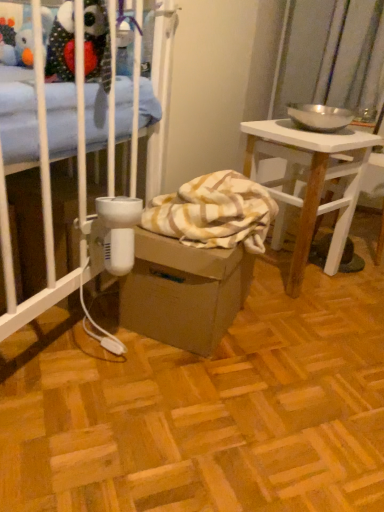
Question: Considering the relative positions of brown cardboard box at center and white wood desk at right in the image provided, is brown cardboard box at center to the left or to the right of white wood desk at right?

Choices:
 (A) right
 (B) left

Answer: (B)

Question: From a real-world perspective, relative to white wood desk at right, is brown cardboard box at center vertically above or below?

Choices:
 (A) above
 (B) below

Answer: (B)

Question: Is brown cardboard box at center situated inside white wood desk at right or outside?

Choices:
 (A) outside
 (B) inside

Answer: (A)

Question: From their relative heights in the image, would you say white wood desk at right is taller or shorter than brown cardboard box at center?

Choices:
 (A) short
 (B) tall

Answer: (B)

Question: Considering the positions of white wood desk at right and brown cardboard box at center in the image, is white wood desk at right bigger or smaller than brown cardboard box at center?

Choices:
 (A) small
 (B) big

Answer: (B)

Question: Does point (317, 208) appear closer or farther from the camera than point (223, 256)?

Choices:
 (A) closer
 (B) farther

Answer: (B)

Question: From the image's perspective, is white wood desk at right positioned above or below brown cardboard box at center?

Choices:
 (A) below
 (B) above

Answer: (B)